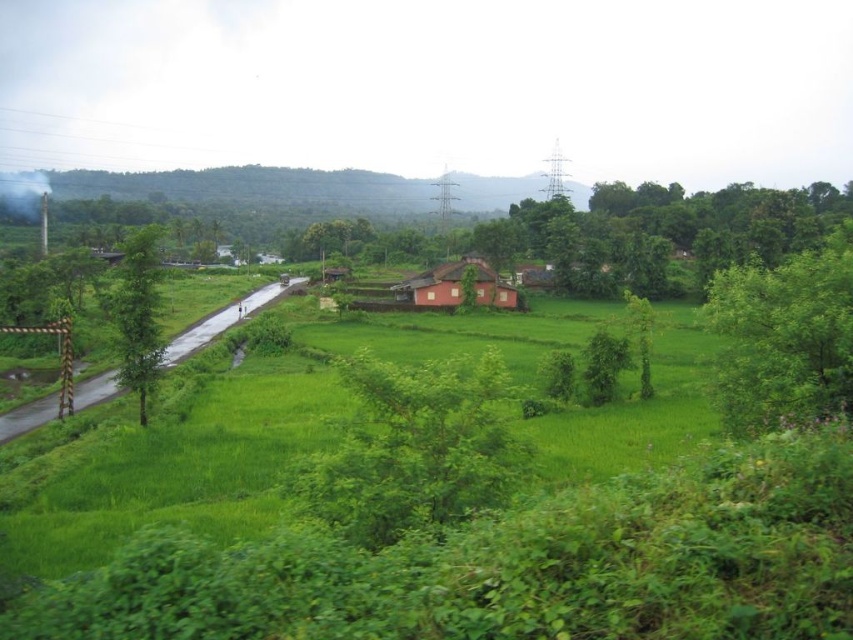
Question: Which object is closer to the camera taking this photo?

Choices:
 (A) green leafy tree at right
 (B) green leafy tree at left
 (C) matte pink house at center

Answer: (A)

Question: Observing the image, what is the correct spatial positioning of green leafy tree at left in reference to matte pink house at center?

Choices:
 (A) below
 (B) above

Answer: (A)

Question: Which is farther from the matte pink house at center?

Choices:
 (A) green leafy tree at left
 (B) green leafy tree at right

Answer: (A)

Question: Is green leafy tree at right positioned behind green leafy tree at left?

Choices:
 (A) yes
 (B) no

Answer: (B)

Question: Can you confirm if green leafy tree at right is positioned to the right of green leafy tree at left?

Choices:
 (A) no
 (B) yes

Answer: (B)

Question: Which point is closer to the camera?

Choices:
 (A) [x=740, y=372]
 (B) [x=132, y=371]

Answer: (A)